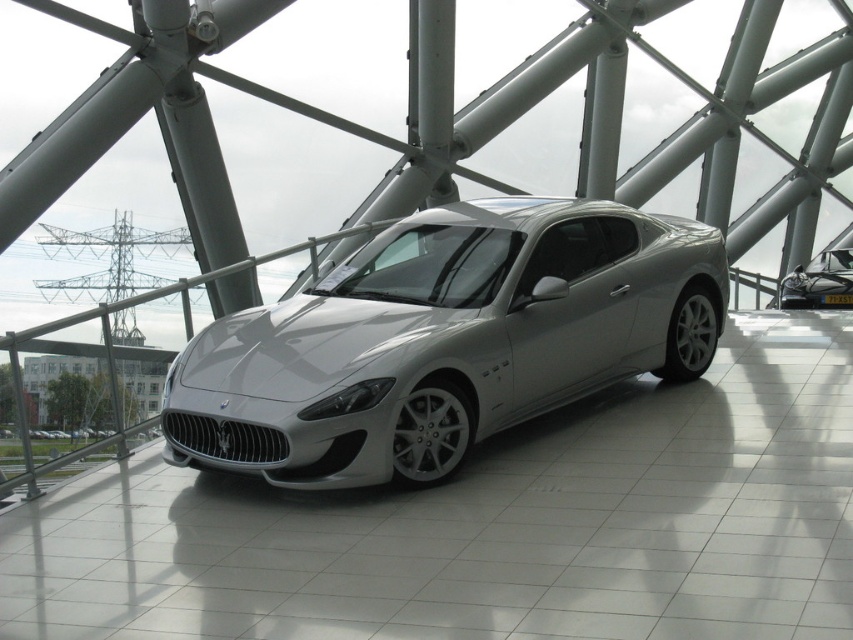
Does sleek silver car at center appear over satin silver car at center?

Actually, sleek silver car at center is below satin silver car at center.

Is point (392, 374) closer to viewer compared to point (778, 289)?

Yes, point (392, 374) is in front of point (778, 289).

Describe the element at coordinates (445, 340) in the screenshot. This screenshot has width=853, height=640. I see `sleek silver car at center` at that location.

You are a GUI agent. You are given a task and a screenshot of the screen. Output one action in this format:
    pyautogui.click(x=<x>, y=<y>)
    Task: Click on the sleek silver car at center
    This screenshot has height=640, width=853.
    Given the screenshot: What is the action you would take?
    pyautogui.click(x=445, y=340)